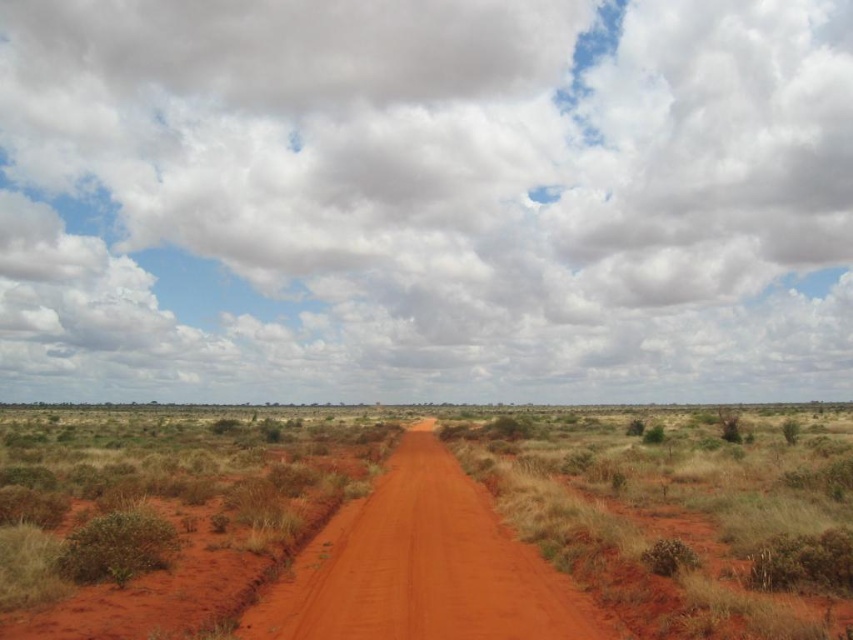
You are driving a car and see the image. You need to follow the path that is to the right of the other road. Which one should you follow, the dusty red dirt road at center or the dusty red dirt track at center?

You should follow the dusty red dirt track at center because the dusty red dirt road at center is to the left of it, so the track is to the right of the road.